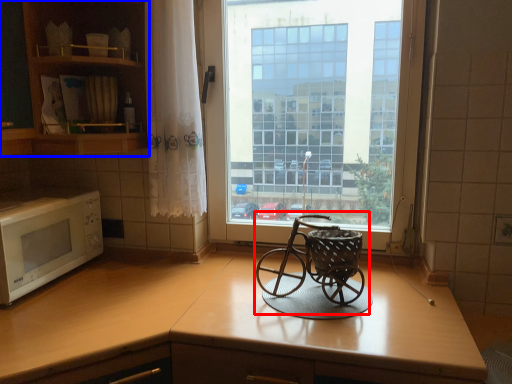
Question: Which object appears farthest to the camera in this image, baby carriage (highlighted by a red box) or cabinetry (highlighted by a blue box)?

Choices:
 (A) baby carriage
 (B) cabinetry

Answer: (B)